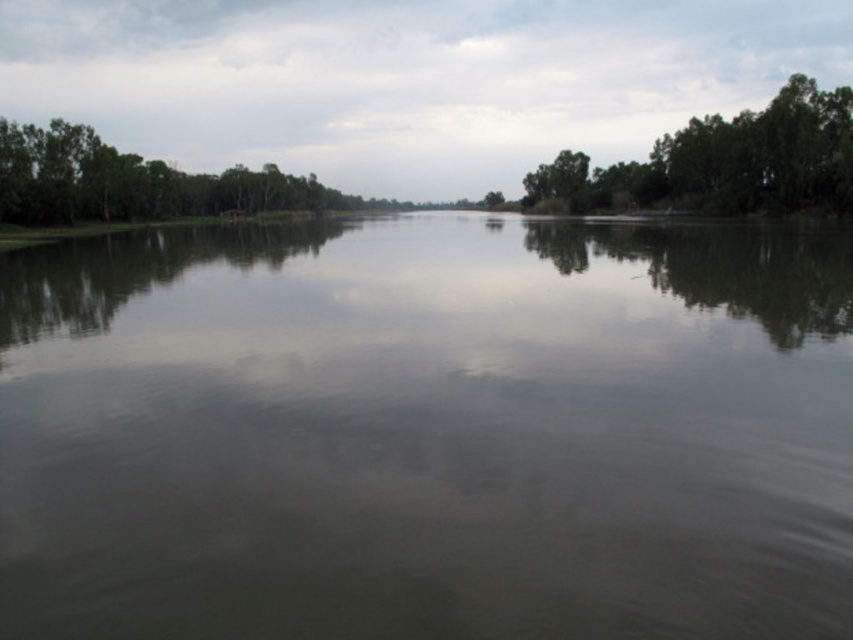
Question: Among these objects, which one is farthest from the camera?

Choices:
 (A) green reflective water at center
 (B) green leafy trees at right

Answer: (B)

Question: Which point appears farthest from the camera in this image?

Choices:
 (A) (212, 344)
 (B) (782, 160)
 (C) (64, 132)

Answer: (C)

Question: Is the position of green reflective water at center less distant than that of green leafy trees at left?

Choices:
 (A) yes
 (B) no

Answer: (A)

Question: Can you confirm if green leafy trees at right is bigger than green leafy trees at left?

Choices:
 (A) no
 (B) yes

Answer: (A)

Question: Among these objects, which one is nearest to the camera?

Choices:
 (A) green leafy trees at left
 (B) green reflective water at center

Answer: (B)

Question: Is green leafy trees at right to the left of green leafy trees at left from the viewer's perspective?

Choices:
 (A) no
 (B) yes

Answer: (A)